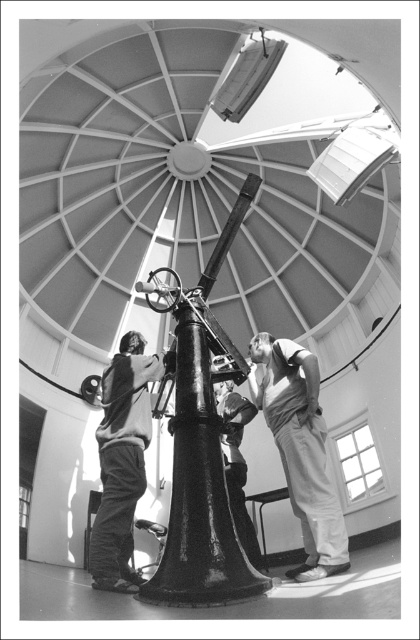
You are a maintenance worker needing to inspect both the polished metal telescope at center and the smooth fabric shirt at center. Given that your ladder can extend up to 10 feet, can you safely reach both objects without needing to move the ladder?

The distance between the polished metal telescope at center and the smooth fabric shirt at center is 12.47 feet. Since your ladder only extends up to 10 feet, you cannot safely reach both objects without moving the ladder.

You are standing at the base of the telescope in the observatory dome. You notice two items in the scene described in the image. One is the light gray cotton pants at lower right and the other is the matte black clothing at center. Which item is physically nearer to your current position?

The light gray cotton pants at lower right is closer to the viewer than matte black clothing at center, so the light gray cotton pants at lower right is physically nearer to your current position.

You are standing inside an observatory dome and looking up at the ceiling. You notice a point marked at coordinates (202,452). What object is located at that point?

The polished metal telescope at center is located at point (202,452).